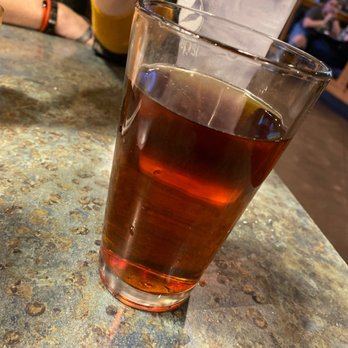
Identify the location of glass. The width and height of the screenshot is (348, 348). (298, 84).